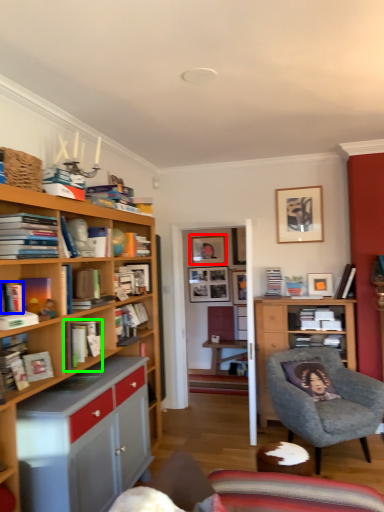
Question: Which is farther away from picture frame (highlighted by a red box)? book (highlighted by a blue box) or book (highlighted by a green box)?

Choices:
 (A) book
 (B) book

Answer: (A)